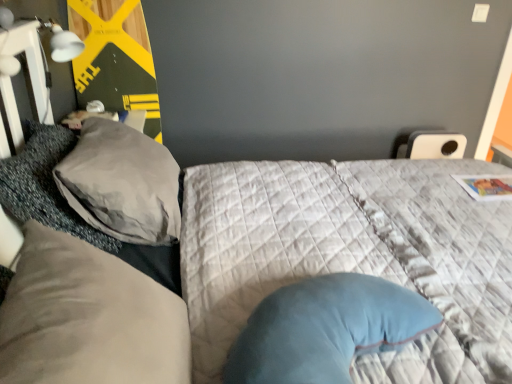
Question: In the image, is gray textured pillow at left, the second pillow positioned from the back, positioned in front of or behind velvety blue pillow at center?

Choices:
 (A) front
 (B) behind

Answer: (B)

Question: From the image's perspective, relative to velvety blue pillow at center, is gray textured pillow at left, which is the second pillow in front-to-back order, above or below?

Choices:
 (A) above
 (B) below

Answer: (A)

Question: Which object is positioned farthest from the gray textured pillow at left, which is the second pillow in front-to-back order?

Choices:
 (A) velvety blue pillow at center
 (B) matte yellow wood board at upper left
 (C) gray fabric pillow at left, the first pillow in the back-to-front sequence
 (D) suede-like beige pillow at left, which is the third pillow in back-to-front order

Answer: (B)

Question: Estimate the real-world distances between objects in this image. Which object is farther from the suede-like beige pillow at left, which is the third pillow in back-to-front order?

Choices:
 (A) velvety blue pillow at center
 (B) gray textured pillow at left, the second pillow positioned from the back
 (C) gray fabric pillow at left, the first pillow in the back-to-front sequence
 (D) matte yellow wood board at upper left

Answer: (D)